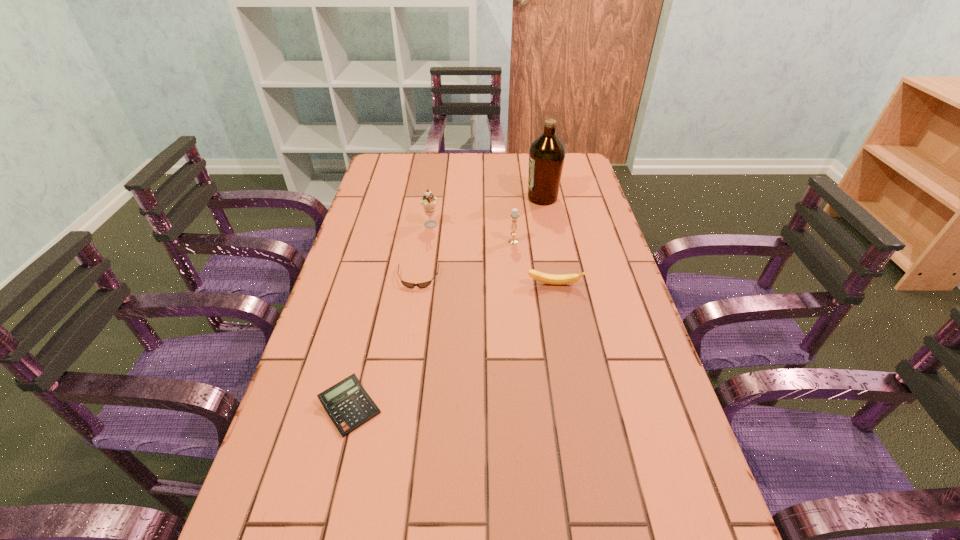
I want to click on banana present at the right edge, so click(553, 279).

Locate an element on the screen. free point at the far edge is located at coordinates point(487,181).

The width and height of the screenshot is (960, 540). I want to click on vacant space at the left edge of the desktop, so click(x=392, y=191).

Where is `free space at the right edge of the desktop`? The image size is (960, 540). free space at the right edge of the desktop is located at coordinates (703, 516).

Find the location of a particular element. free space between the tallest object and the nearest object is located at coordinates (446, 302).

Find the location of a particular element. This screenshot has height=540, width=960. free space between the olive oil and the second tallest object is located at coordinates (487, 212).

You are a GUI agent. You are given a task and a screenshot of the screen. Output one action in this format:
    pyautogui.click(x=<x>, y=<y>)
    Task: Click on the free spot between the fourth object from left to right and the fifth shortest object
    The width and height of the screenshot is (960, 540).
    Given the screenshot: What is the action you would take?
    pyautogui.click(x=472, y=233)

The image size is (960, 540). Identify the location of free point between the shortest object and the nearest object. (384, 343).

You are a GUI agent. You are given a task and a screenshot of the screen. Output one action in this format:
    pyautogui.click(x=<x>, y=<y>)
    Task: Click on the vacant space that's between the second shortest object and the second farthest object
    This screenshot has height=540, width=960.
    Given the screenshot: What is the action you would take?
    pyautogui.click(x=390, y=316)

At what (x,y) coordinates should I click in order to perform the action: click on vacant point located between the shortest object and the fourth object from left to right. Please return your answer as a coordinate pair (x, y). The height and width of the screenshot is (540, 960). Looking at the image, I should click on (466, 260).